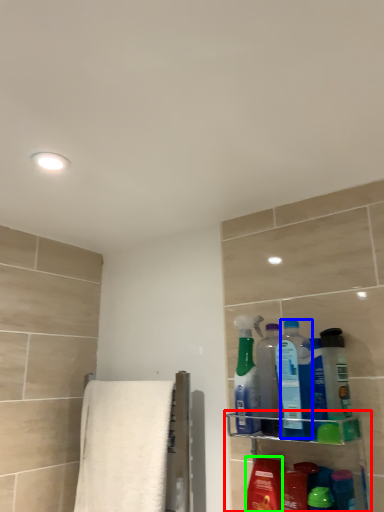
Question: Estimate the real-world distances between objects in this image. Which object is closer to shelf (highlighted by a red box), cleaning product (highlighted by a blue box) or mouthwash (highlighted by a green box)?

Choices:
 (A) cleaning product
 (B) mouthwash

Answer: (B)